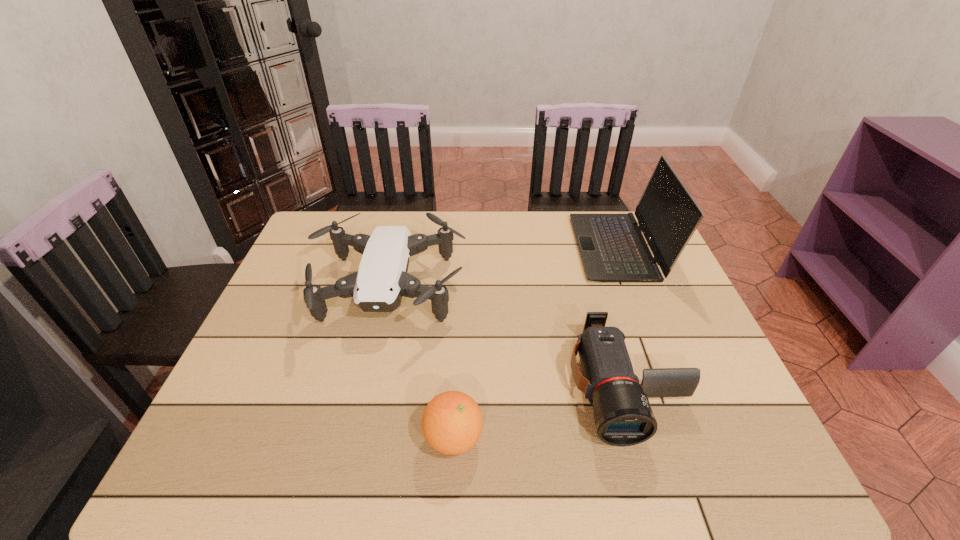
In order to click on vacant space at the far edge of the desktop in this screenshot , I will do `click(462, 221)`.

Locate an element on the screen. This screenshot has height=540, width=960. free space at the near edge of the desktop is located at coordinates (273, 476).

Find the location of a particular element. The image size is (960, 540). free point at the left edge is located at coordinates (272, 298).

This screenshot has height=540, width=960. Find the location of `free location at the right edge of the desktop`. free location at the right edge of the desktop is located at coordinates (726, 369).

Find the location of a particular element. free space between the drone and the tallest object is located at coordinates (504, 269).

Where is `vacant point located between the camcorder and the orange`? vacant point located between the camcorder and the orange is located at coordinates (540, 412).

Locate an element on the screen. Image resolution: width=960 pixels, height=540 pixels. vacant area between the second tallest object and the laptop computer is located at coordinates (504, 269).

At what (x,y) coordinates should I click in order to perform the action: click on free space that is in between the drone and the orange. Please return your answer as a coordinate pair (x, y). Image resolution: width=960 pixels, height=540 pixels. Looking at the image, I should click on 421,364.

Locate an element on the screen. This screenshot has width=960, height=540. blank region between the camcorder and the tallest object is located at coordinates (622, 317).

I want to click on empty location between the orange and the camcorder, so click(x=540, y=412).